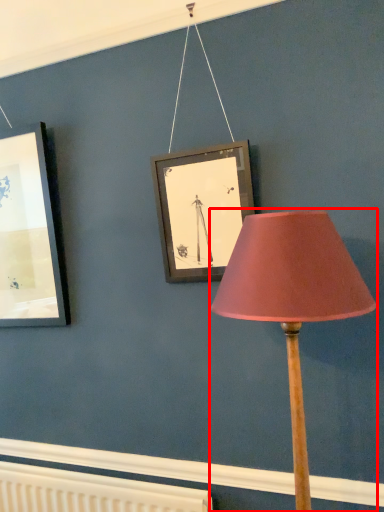
Question: From the image's perspective, what is the correct spatial positioning of lamp (annotated by the red box) in reference to radiator?

Choices:
 (A) below
 (B) above

Answer: (B)